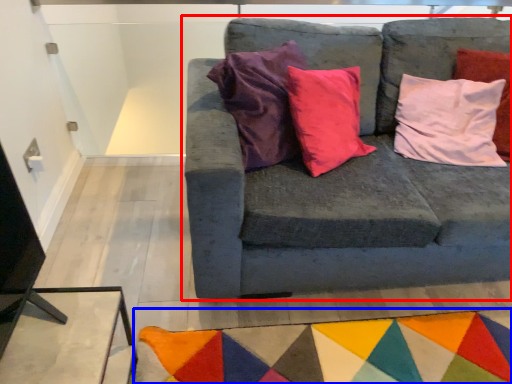
Question: Among these objects, which one is farthest to the camera, studio couch (highlighted by a red box) or mat (highlighted by a blue box)?

Choices:
 (A) studio couch
 (B) mat

Answer: (B)